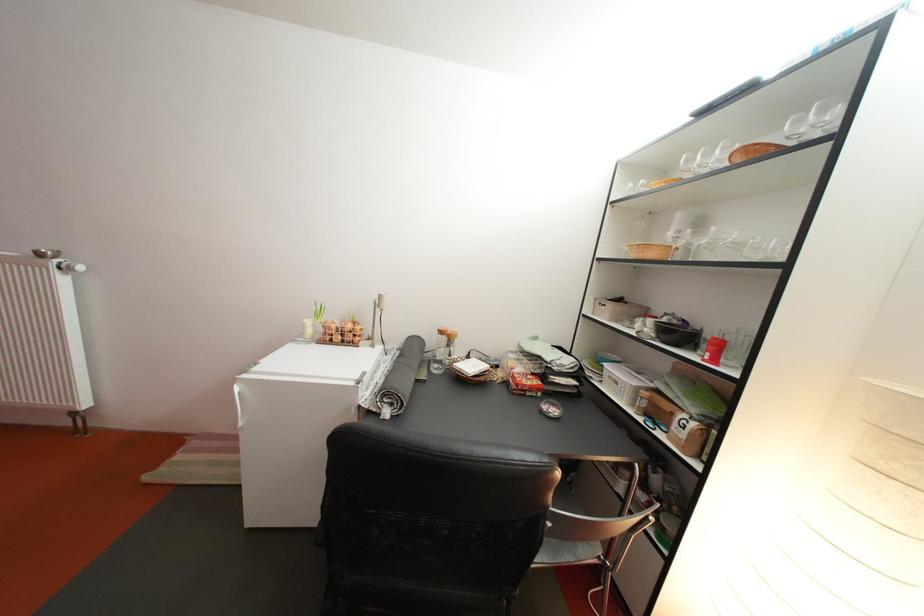
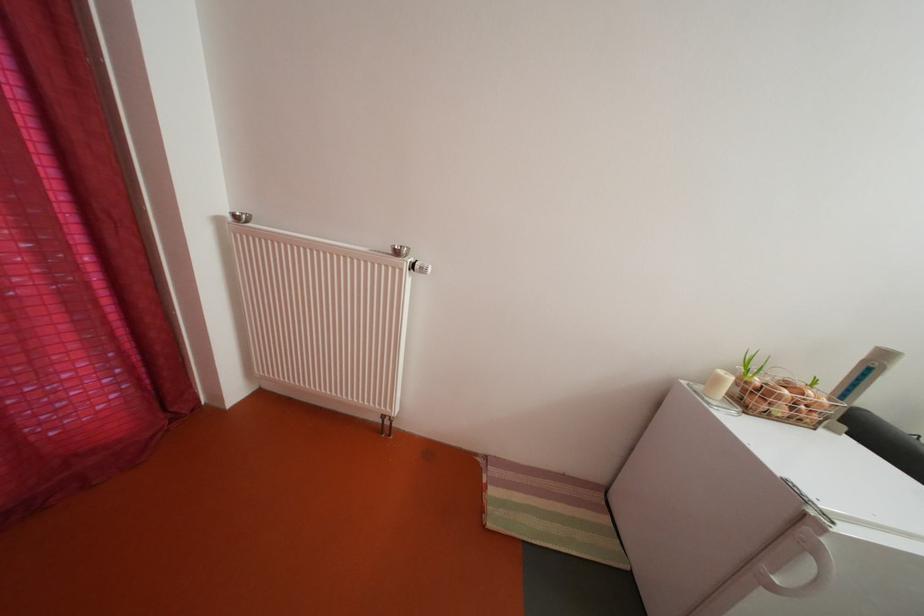
Find the pixel in the second image that matches the point at 314,331 in the first image.

(728, 386)